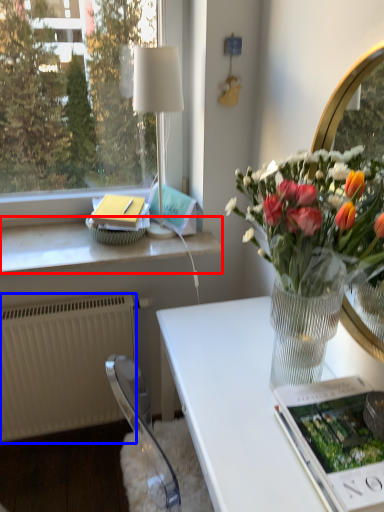
Question: Which of the following is the farthest to the observer, window sill (highlighted by a red box) or radiator (highlighted by a blue box)?

Choices:
 (A) window sill
 (B) radiator

Answer: (B)